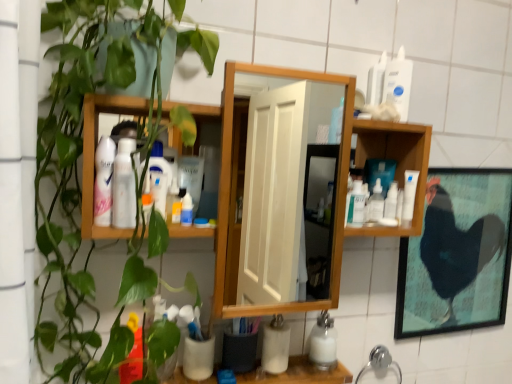
Question: Considering their positions, is white matte cup at lower center located in front of or behind black matte chicken at right?

Choices:
 (A) front
 (B) behind

Answer: (A)

Question: From a real-world perspective, is white matte cup at lower center above or below black matte chicken at right?

Choices:
 (A) above
 (B) below

Answer: (B)

Question: Based on their relative distances, which object is farther from the white glossy lotion at upper left, which is the third toiletry in top-to-bottom order?

Choices:
 (A) translucent plastic spray bottle at center, the 1th cleaning product viewed from the left
 (B) green matte plant at left
 (C) white matte bottle at lower center, positioned as the 1th cleaning product in bottom-to-top order
 (D) matte white spray can at upper left, positioned as the 1th toiletry in left-to-right order
 (E) clear plastic bottle at center-right, which is the 2th cleaning product in back-to-front order

Answer: (C)

Question: Estimate the real-world distances between objects in this image. Which object is farther from the white plastic bottle at upper right, arranged as the 1th toiletry when viewed from the back?

Choices:
 (A) green matte plant at left
 (B) matte white spray can at upper left, positioned as the 4th toiletry in right-to-left order
 (C) white matte cup at lower center, acting as the first toiletry starting from the bottom
 (D) chrome metallic faucet at lower center
 (E) white glossy lotion at upper left, marked as the 2th toiletry in a bottom-to-top arrangement

Answer: (D)